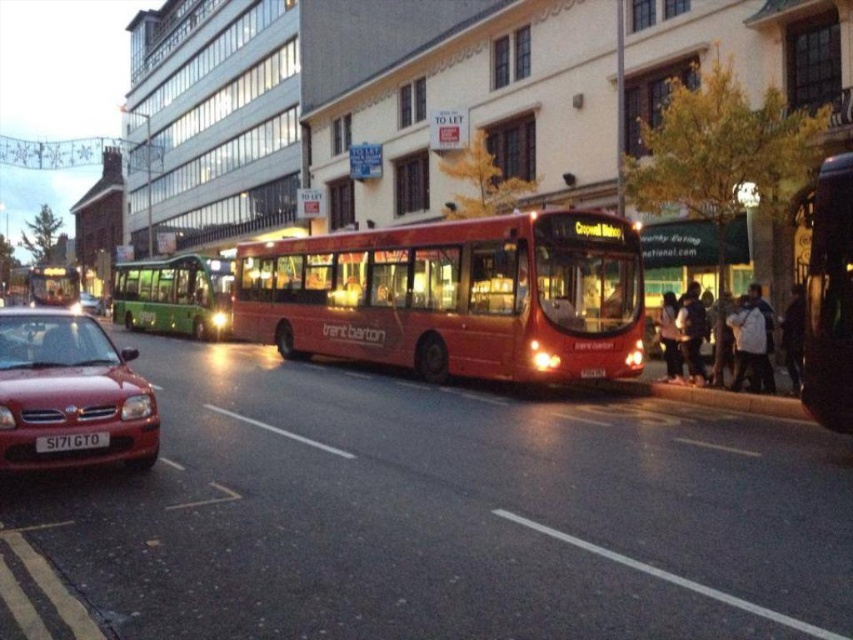
Can you confirm if green metallic bus at left is wider than metallic red car at left?

Correct, the width of green metallic bus at left exceeds that of metallic red car at left.

Is point (173, 273) positioned in front of point (97, 298)?

Yes, it is.

Which is in front, point (216, 273) or point (90, 298)?

Positioned in front is point (216, 273).

I want to click on green metallic bus at left, so click(x=173, y=296).

Can you confirm if metallic red bus at right is positioned below metallic red car at left?

Indeed, metallic red bus at right is positioned under metallic red car at left.

Is metallic red bus at right to the right of metallic red car at left from the viewer's perspective?

Indeed, metallic red bus at right is positioned on the right side of metallic red car at left.

Locate an element on the screen. metallic red bus at right is located at coordinates (828, 298).

I want to click on metallic red bus at right, so click(x=828, y=298).

Between shiny red bus at center and green metallic bus at left, which one has less height?

shiny red bus at center is shorter.

Between shiny red bus at center and green metallic bus at left, which one appears on the left side from the viewer's perspective?

Positioned to the left is green metallic bus at left.

Identify the location of shiny red bus at center. The width and height of the screenshot is (853, 640). (454, 296).